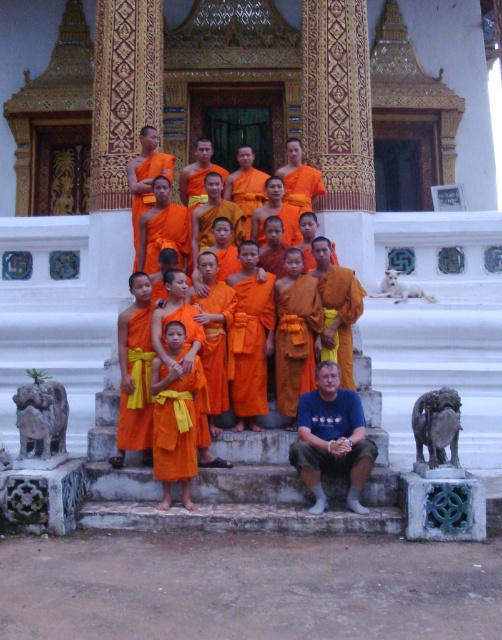
Between orange cloth at center and blue t-shirt at lower center, which one is positioned lower?

blue t-shirt at lower center is lower down.

The width and height of the screenshot is (502, 640). What are the coordinates of `orange cloth at center` in the screenshot? It's located at (293, 250).

Identify the location of orange cloth at center. The image size is (502, 640). (293, 250).